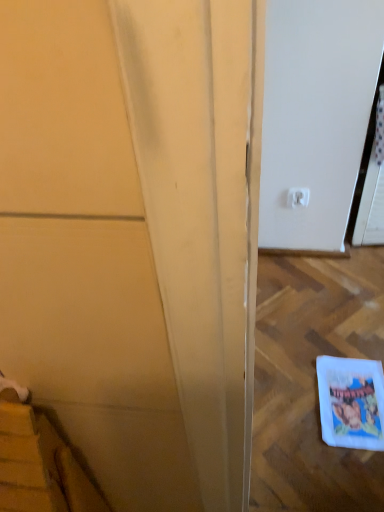
What are the coordinates of `white plastic electric outlet at upper right` in the screenshot? It's located at 298,197.

Describe the element at coordinates (298, 197) in the screenshot. I see `white plastic electric outlet at upper right` at that location.

The width and height of the screenshot is (384, 512). Describe the element at coordinates (135, 236) in the screenshot. I see `matte yellow door at left` at that location.

At what (x,y) coordinates should I click in order to perform the action: click on matte yellow door at left. Please return your answer as a coordinate pair (x, y). Image resolution: width=384 pixels, height=512 pixels. Looking at the image, I should click on (135, 236).

Image resolution: width=384 pixels, height=512 pixels. Describe the element at coordinates (351, 402) in the screenshot. I see `white paper comic book at lower right` at that location.

Locate an element on the screen. The height and width of the screenshot is (512, 384). white plastic electric outlet at upper right is located at coordinates (298, 197).

Can you confirm if white plastic electric outlet at upper right is thinner than matte yellow door at left?

Correct, the width of white plastic electric outlet at upper right is less than that of matte yellow door at left.

Is white plastic electric outlet at upper right to the left of matte yellow door at left from the viewer's perspective?

No.

From the image's perspective, is white plastic electric outlet at upper right positioned above or below white paper comic book at lower right?

Clearly, from the image's perspective, white plastic electric outlet at upper right is above white paper comic book at lower right.

This screenshot has width=384, height=512. In order to click on comic book below the white plastic electric outlet at upper right (from the image's perspective) in this screenshot , I will do `click(351, 402)`.

Between white plastic electric outlet at upper right and white paper comic book at lower right, which one has larger width?

With larger width is white paper comic book at lower right.

Is white paper comic book at lower right a part of white plastic electric outlet at upper right?

No, white plastic electric outlet at upper right does not contain white paper comic book at lower right.

Is the position of white paper comic book at lower right more distant than that of matte yellow door at left?

Yes, it is behind matte yellow door at left.

Can we say white paper comic book at lower right lies outside matte yellow door at left?

white paper comic book at lower right lies outside matte yellow door at left's area.

Would you consider white paper comic book at lower right to be distant from matte yellow door at left?

white paper comic book at lower right is near matte yellow door at left, not far away.

Is white plastic electric outlet at upper right surrounded by white paper comic book at lower right?

Answer: Actually, white plastic electric outlet at upper right is outside white paper comic book at lower right.

From the image's perspective, between white paper comic book at lower right and white plastic electric outlet at upper right, which one is located above?

white plastic electric outlet at upper right, from the image's perspective.

Is white paper comic book at lower right further to the viewer compared to white plastic electric outlet at upper right?

No, white paper comic book at lower right is in front of white plastic electric outlet at upper right.

Which is more to the left, matte yellow door at left or white plastic electric outlet at upper right?

Positioned to the left is matte yellow door at left.

Based on the photo, considering the relative sizes of matte yellow door at left and white plastic electric outlet at upper right in the image provided, is matte yellow door at left bigger than white plastic electric outlet at upper right?

Correct, matte yellow door at left is larger in size than white plastic electric outlet at upper right.

From a real-world perspective, is matte yellow door at left beneath white plastic electric outlet at upper right?

Actually, matte yellow door at left is physically above white plastic electric outlet at upper right in the real world.

Looking at this image, is matte yellow door at left aimed at white plastic electric outlet at upper right?

No, matte yellow door at left is not oriented towards white plastic electric outlet at upper right.

Does matte yellow door at left have a smaller size compared to white paper comic book at lower right?

Incorrect, matte yellow door at left is not smaller in size than white paper comic book at lower right.

Is point (33, 311) less distant than point (348, 432)?

Yes, it is in front of point (348, 432).

Based on the photo, is matte yellow door at left to the left or to the right of white paper comic book at lower right in the image?

In the image, matte yellow door at left appears on the left side of white paper comic book at lower right.

Is there a large distance between matte yellow door at left and white paper comic book at lower right?

That's not correct — matte yellow door at left is a little close to white paper comic book at lower right.

The height and width of the screenshot is (512, 384). In the image, there is a matte yellow door at left. In order to click on electric outlet above it (from the image's perspective) in this screenshot , I will do `click(298, 197)`.

I want to click on electric outlet above the white paper comic book at lower right (from a real-world perspective), so click(x=298, y=197).

From the picture: From the image, which object appears to be nearer to white plastic electric outlet at upper right, white paper comic book at lower right or matte yellow door at left?

Among the two, white paper comic book at lower right is located nearer to white plastic electric outlet at upper right.

Based on their spatial positions, is white plastic electric outlet at upper right or white paper comic book at lower right further from matte yellow door at left?

white plastic electric outlet at upper right.

Which object lies nearer to the anchor point white paper comic book at lower right, white plastic electric outlet at upper right or matte yellow door at left?

Based on the image, white plastic electric outlet at upper right appears to be nearer to white paper comic book at lower right.

Considering their positions, is white paper comic book at lower right positioned further to matte yellow door at left than white plastic electric outlet at upper right?

Among the two, white plastic electric outlet at upper right is located further to matte yellow door at left.

Estimate the real-world distances between objects in this image. Which object is closer to white plastic electric outlet at upper right, matte yellow door at left or white paper comic book at lower right?

white paper comic book at lower right is closer to white plastic electric outlet at upper right.

From the image, which object appears to be nearer to white paper comic book at lower right, matte yellow door at left or white plastic electric outlet at upper right?

white plastic electric outlet at upper right is closer to white paper comic book at lower right.

The height and width of the screenshot is (512, 384). Identify the location of comic book between matte yellow door at left and white plastic electric outlet at upper right in the front-back direction. point(351,402).